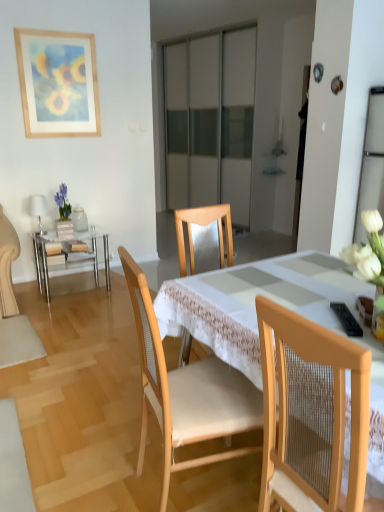
The image size is (384, 512). Identify the location of free space to the left of black plastic remote control at lower right. (319, 316).